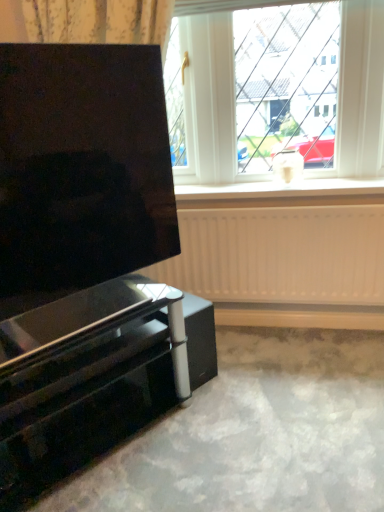
Question: From a real-world perspective, is white plastic window at upper center located higher than matte black screen at left?

Choices:
 (A) yes
 (B) no

Answer: (A)

Question: From the image's perspective, is white plastic window at upper center beneath matte black screen at left?

Choices:
 (A) no
 (B) yes

Answer: (A)

Question: Considering the relative sizes of white plastic window at upper center and matte black screen at left in the image provided, is white plastic window at upper center shorter than matte black screen at left?

Choices:
 (A) no
 (B) yes

Answer: (A)

Question: Is white plastic window at upper center to the left of matte black screen at left from the viewer's perspective?

Choices:
 (A) no
 (B) yes

Answer: (A)

Question: Can you confirm if white plastic window at upper center is smaller than matte black screen at left?

Choices:
 (A) yes
 (B) no

Answer: (A)

Question: Is white plastic window at upper center facing towards matte black screen at left?

Choices:
 (A) yes
 (B) no

Answer: (A)

Question: Does matte black screen at left appear on the right side of white matte window sill at center?

Choices:
 (A) no
 (B) yes

Answer: (A)

Question: Can you confirm if matte black screen at left is taller than white matte window sill at center?

Choices:
 (A) yes
 (B) no

Answer: (A)

Question: Is matte black screen at left next to white matte window sill at center?

Choices:
 (A) no
 (B) yes

Answer: (A)

Question: Is matte black screen at left wider than white matte window sill at center?

Choices:
 (A) no
 (B) yes

Answer: (A)

Question: Is matte black screen at left positioned in front of white matte window sill at center?

Choices:
 (A) no
 (B) yes

Answer: (B)

Question: Is matte black screen at left positioned with its back to white matte window sill at center?

Choices:
 (A) yes
 (B) no

Answer: (B)

Question: Is white matte window sill at center outside of glossy black tv stand at lower left?

Choices:
 (A) yes
 (B) no

Answer: (A)